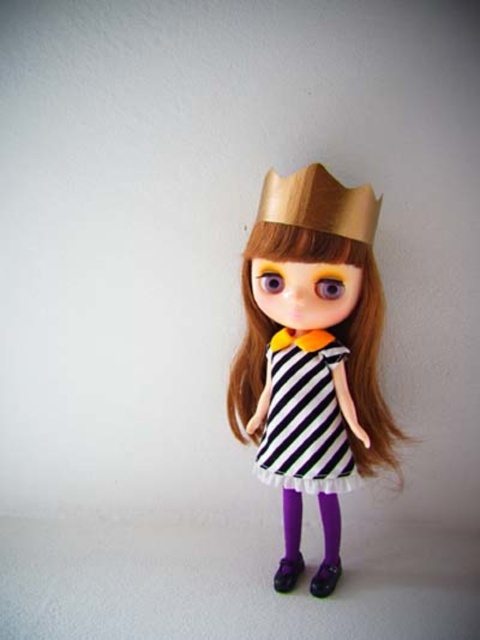
Question: Which point appears closest to the camera in this image?

Choices:
 (A) click(x=362, y=211)
 (B) click(x=348, y=436)
 (C) click(x=283, y=397)

Answer: (A)

Question: Is black and white striped dress at center above black striped dress at center?

Choices:
 (A) yes
 (B) no

Answer: (A)

Question: Considering the real-world distances, which object is closest to the black and white striped dress at center?

Choices:
 (A) black striped dress at center
 (B) wooden crown at center

Answer: (A)

Question: Does black and white striped dress at center lie behind wooden crown at center?

Choices:
 (A) yes
 (B) no

Answer: (A)

Question: Which of the following is the closest to the observer?

Choices:
 (A) black and white striped dress at center
 (B) black striped dress at center

Answer: (A)

Question: Is black and white striped dress at center closer to the viewer compared to black striped dress at center?

Choices:
 (A) no
 (B) yes

Answer: (B)